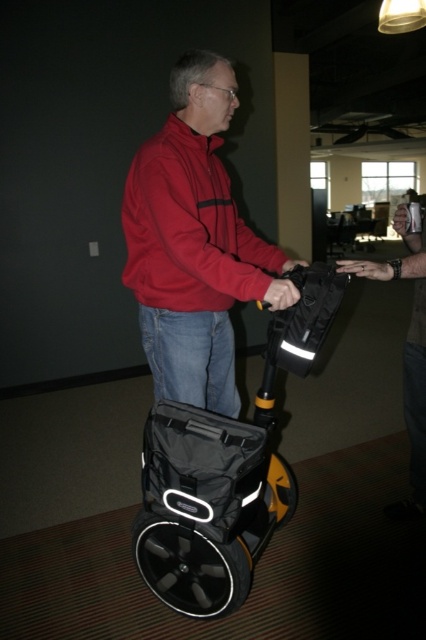
Question: Is black matte scooter at center below denim jacket at center?

Choices:
 (A) yes
 (B) no

Answer: (A)

Question: From the image, what is the correct spatial relationship of matte red jacket at center in relation to black matte scooter at center?

Choices:
 (A) right
 (B) left

Answer: (B)

Question: Which of the following is the farthest from the observer?

Choices:
 (A) denim jacket at center
 (B) matte red jacket at center

Answer: (A)

Question: Which object is closer to the camera taking this photo?

Choices:
 (A) black matte scooter at center
 (B) denim jacket at center
 (C) matte red jacket at center

Answer: (C)

Question: Which is farther from the denim jacket at center?

Choices:
 (A) matte red jacket at center
 (B) black matte scooter at center

Answer: (B)

Question: Does black matte scooter at center appear under denim jacket at center?

Choices:
 (A) no
 (B) yes

Answer: (B)